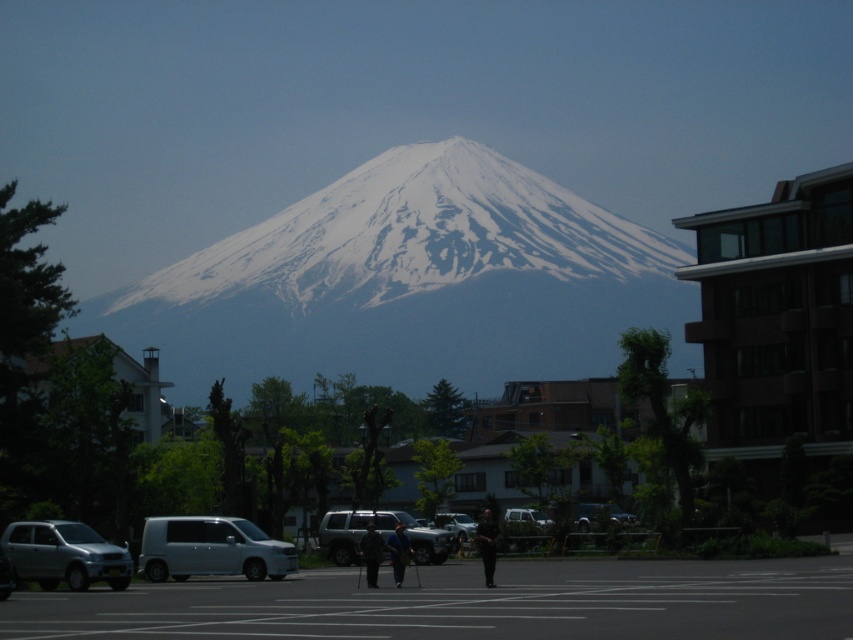
Is the position of dark blue shirt at center more distant than that of metallic silver car at center?

No, it is in front of metallic silver car at center.

Can you confirm if dark blue shirt at center is positioned above metallic silver car at center?

Yes.

Is point (492, 548) less distant than point (444, 515)?

That is True.

Where is `dark blue shirt at center`? This screenshot has height=640, width=853. dark blue shirt at center is located at coordinates (486, 545).

Between white matte van at center and dark gray fabric pants at center, which one has less height?

Standing shorter between the two is white matte van at center.

Which is in front, point (247, 538) or point (361, 557)?

Point (247, 538)

Identify the location of white matte van at center. This screenshot has width=853, height=640. (212, 548).

Which of these two, silver metallic suv at center or dark blue shirt at center, stands shorter?

Standing shorter between the two is silver metallic suv at center.

Which is in front, point (430, 540) or point (494, 532)?

Point (494, 532) is more forward.

Where is `silver metallic suv at center`? silver metallic suv at center is located at coordinates (380, 536).